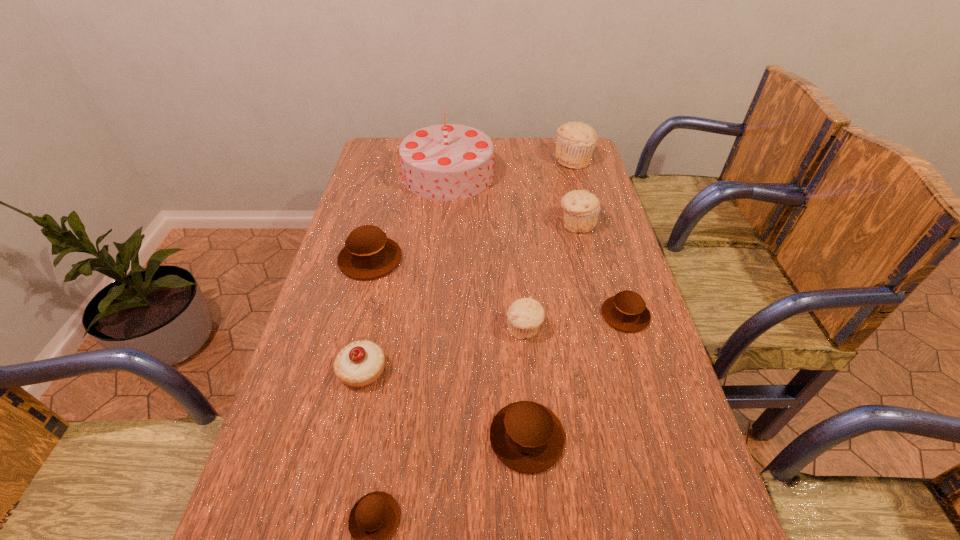
Locate an element on the screen. the tallest object is located at coordinates 445,162.

Find the location of `the second tallest object`. the second tallest object is located at coordinates (576, 141).

The image size is (960, 540). Identify the location of the farthest beige muffin. [576, 141].

Find the location of a particular element. the second smallest beige muffin is located at coordinates (581, 208).

In order to click on the third farthest object in this screenshot , I will do `click(581, 208)`.

Where is `the fifth nearest muffin`? the fifth nearest muffin is located at coordinates (368, 254).

Locate an element on the screen. the fourth farthest object is located at coordinates (368, 254).

Find the location of a particular element. the smallest beige muffin is located at coordinates (525, 315).

The width and height of the screenshot is (960, 540). Identify the location of the leftmost beige muffin. (525, 315).

Where is `the second biggest brown muffin`? The height and width of the screenshot is (540, 960). the second biggest brown muffin is located at coordinates (526, 436).